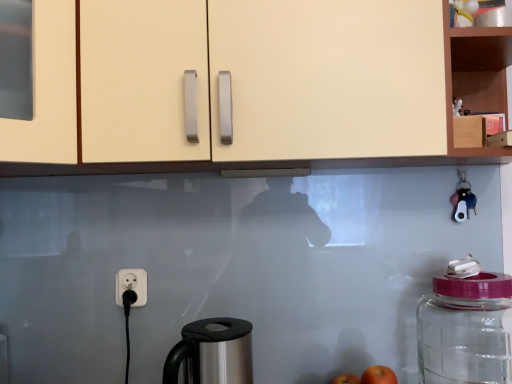
Question: From the image's perspective, would you say matte cream cabinet at upper center, the second cabinetry from the right, is shown under transparent glass jar at right?

Choices:
 (A) no
 (B) yes

Answer: (A)

Question: Is matte cream cabinet at upper center, which appears as the 1th cabinetry when viewed from the left, to the left of transparent glass jar at right from the viewer's perspective?

Choices:
 (A) yes
 (B) no

Answer: (A)

Question: From a real-world perspective, is matte cream cabinet at upper center, which appears as the 1th cabinetry when viewed from the left, on top of transparent glass jar at right?

Choices:
 (A) yes
 (B) no

Answer: (A)

Question: Is matte cream cabinet at upper center, which appears as the 1th cabinetry when viewed from the left, located outside transparent glass jar at right?

Choices:
 (A) yes
 (B) no

Answer: (A)

Question: Is matte cream cabinet at upper center, the second cabinetry from the right, wider than transparent glass jar at right?

Choices:
 (A) no
 (B) yes

Answer: (B)

Question: Is the position of matte cream cabinet at upper center, the second cabinetry from the right, more distant than that of transparent glass jar at right?

Choices:
 (A) yes
 (B) no

Answer: (B)

Question: Is red matte apple at lower right, which is counted as the 2th apple, starting from the top, surrounding transparent glass jar at right?

Choices:
 (A) yes
 (B) no

Answer: (B)

Question: Could you tell me if red matte apple at lower right, acting as the 2th apple starting from the front, is turned towards transparent glass jar at right?

Choices:
 (A) yes
 (B) no

Answer: (B)

Question: Is red matte apple at lower right, the first apple from the back, at the left side of transparent glass jar at right?

Choices:
 (A) yes
 (B) no

Answer: (A)

Question: Can you confirm if red matte apple at lower right, the first apple from the back, is thinner than transparent glass jar at right?

Choices:
 (A) yes
 (B) no

Answer: (A)

Question: Does red matte apple at lower right, acting as the 2th apple starting from the front, have a greater width compared to transparent glass jar at right?

Choices:
 (A) yes
 (B) no

Answer: (B)

Question: From a real-world perspective, is red matte apple at lower right, which is counted as the 2th apple, starting from the top, below transparent glass jar at right?

Choices:
 (A) no
 (B) yes

Answer: (B)

Question: Considering the relative positions of transparent glass jar at right and matte cream cabinet at upper center, the second cabinetry from the right, in the image provided, is transparent glass jar at right to the left of matte cream cabinet at upper center, the second cabinetry from the right, from the viewer's perspective?

Choices:
 (A) yes
 (B) no

Answer: (B)